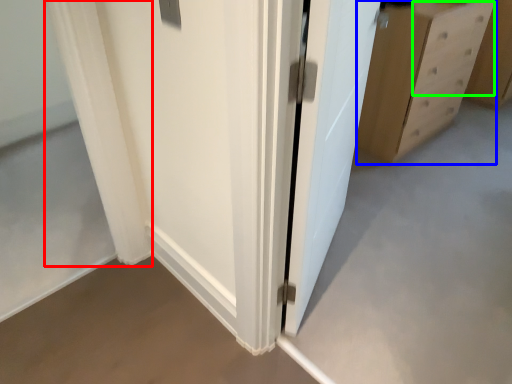
Question: Which object is positioned closest to curtain (highlighted by a red box)? Select from chest of drawers (highlighted by a blue box) and drawer (highlighted by a green box).

Choices:
 (A) chest of drawers
 (B) drawer

Answer: (A)